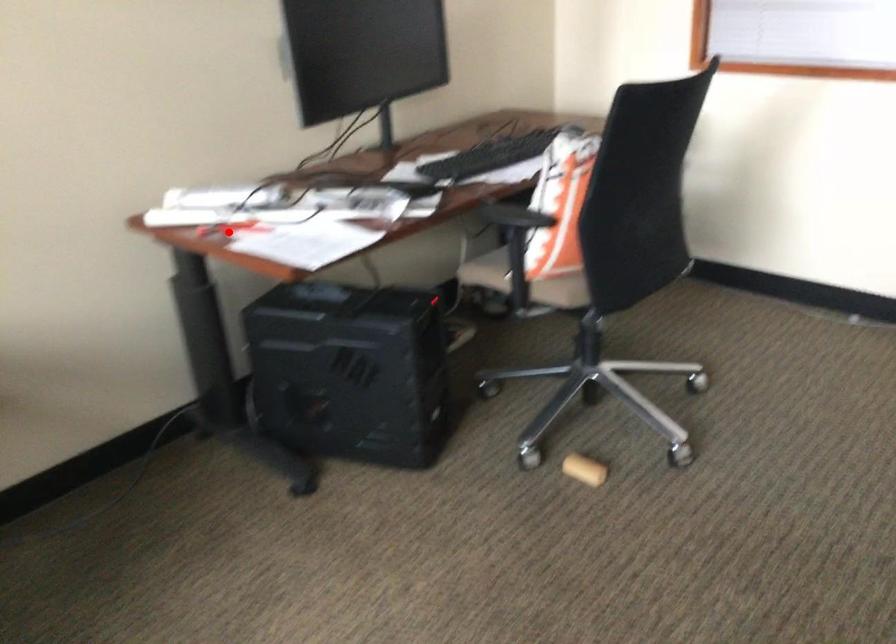
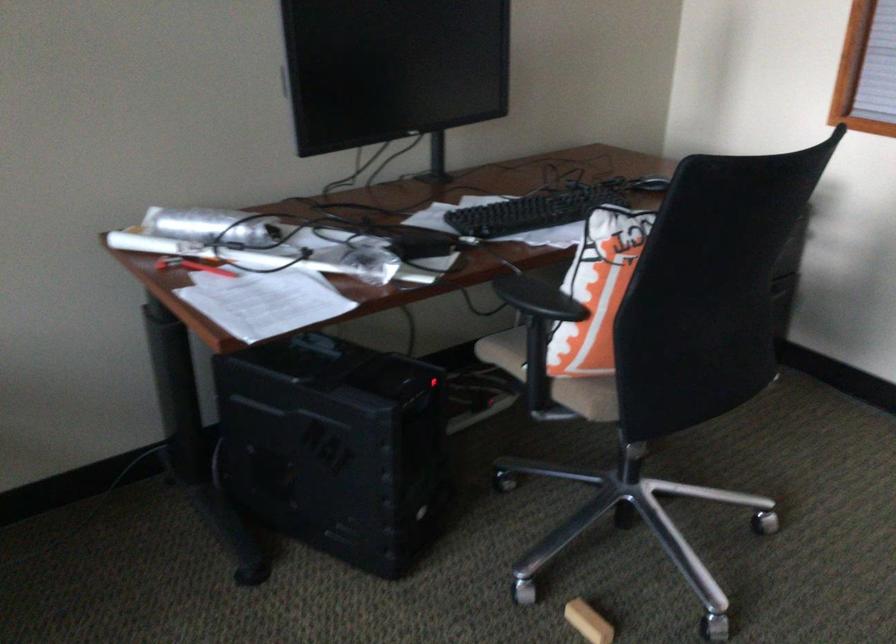
In the second image, find the point that corresponds to the highlighted location in the first image.

(192, 266)